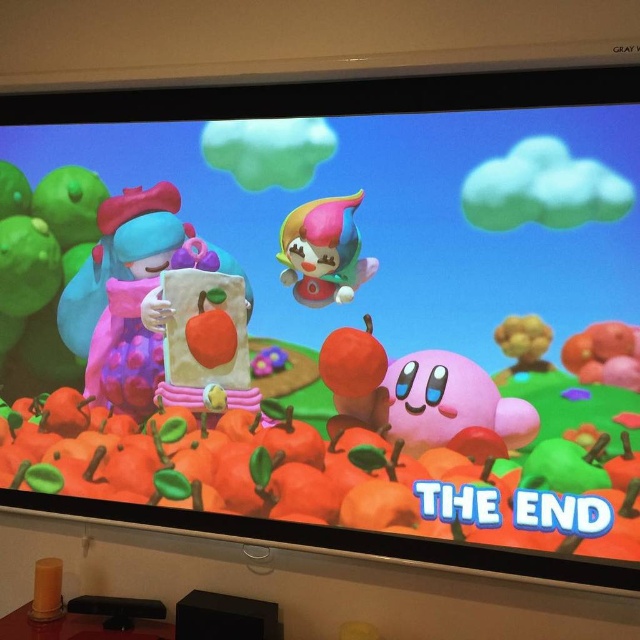
Question: Which point is farther to the camera?

Choices:
 (A) matte pink plush at left
 (B) pastel plastic toy at center

Answer: (A)

Question: Which point is farther from the camera taking this photo?

Choices:
 (A) (241, 278)
 (B) (353, 275)
 (C) (531, 346)

Answer: (A)

Question: Does matte pink plush at left come behind wooden toy at right?

Choices:
 (A) yes
 (B) no

Answer: (A)

Question: Does matte white plush at center come behind wooden toy at right?

Choices:
 (A) yes
 (B) no

Answer: (A)

Question: Can you confirm if matte pink plush at left is wider than matte white plush at center?

Choices:
 (A) no
 (B) yes

Answer: (B)

Question: Which of the following is the farthest from the observer?

Choices:
 (A) (589, 355)
 (B) (118, 221)
 (C) (230, 310)
 (D) (300, 259)

Answer: (B)